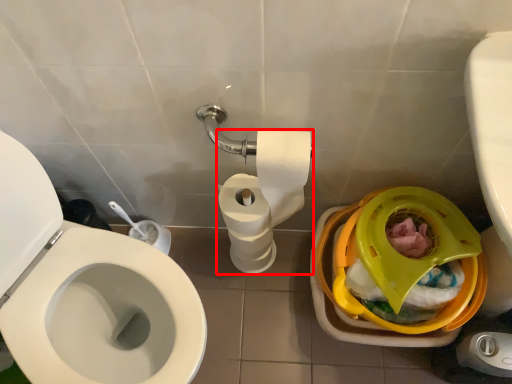
Question: From the image's perspective, considering the relative positions of toilet paper (annotated by the red box) and potty in the image provided, where is toilet paper (annotated by the red box) located with respect to the staircase?

Choices:
 (A) below
 (B) above

Answer: (B)